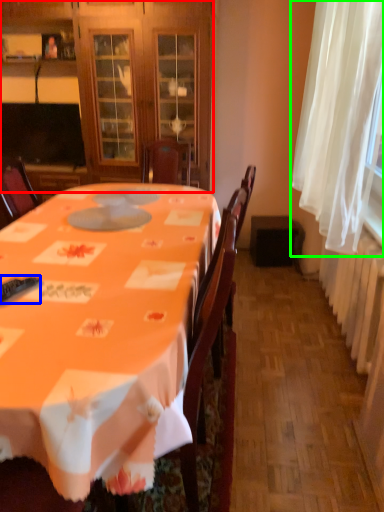
Question: Estimate the real-world distances between objects in this image. Which object is closer to cabinetry (highlighted by a red box), remote control (highlighted by a blue box) or curtain (highlighted by a green box)?

Choices:
 (A) remote control
 (B) curtain

Answer: (B)